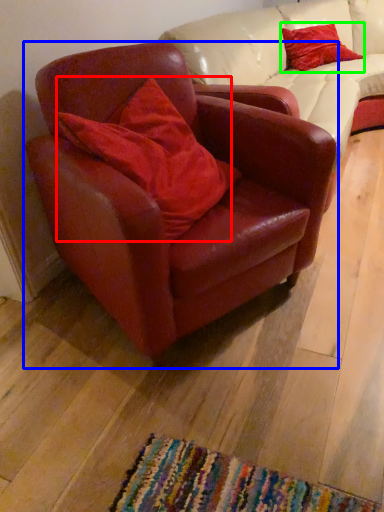
Question: Based on their relative distances, which object is nearer to pillow (highlighted by a red box)? Choose from chair (highlighted by a blue box) and pillow (highlighted by a green box).

Choices:
 (A) chair
 (B) pillow

Answer: (A)